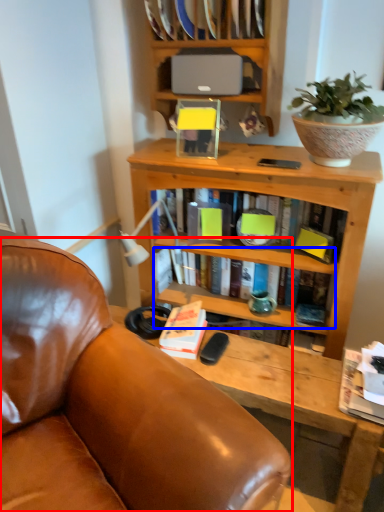
Question: Which of the following is the farthest to the observer, chair (highlighted by a red box) or book (highlighted by a blue box)?

Choices:
 (A) chair
 (B) book

Answer: (B)